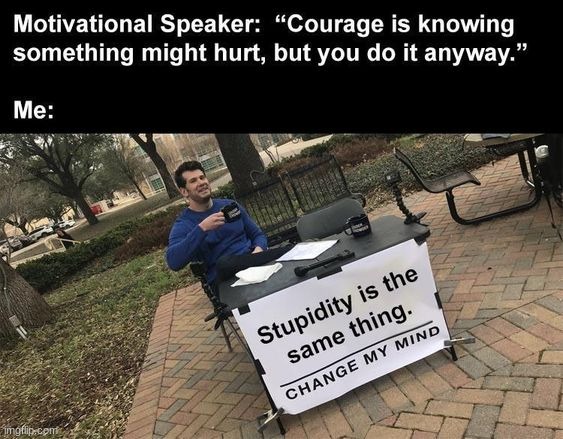
Image resolution: width=563 pixels, height=439 pixels. Identify the location of chair. (446, 178), (338, 215), (202, 277).